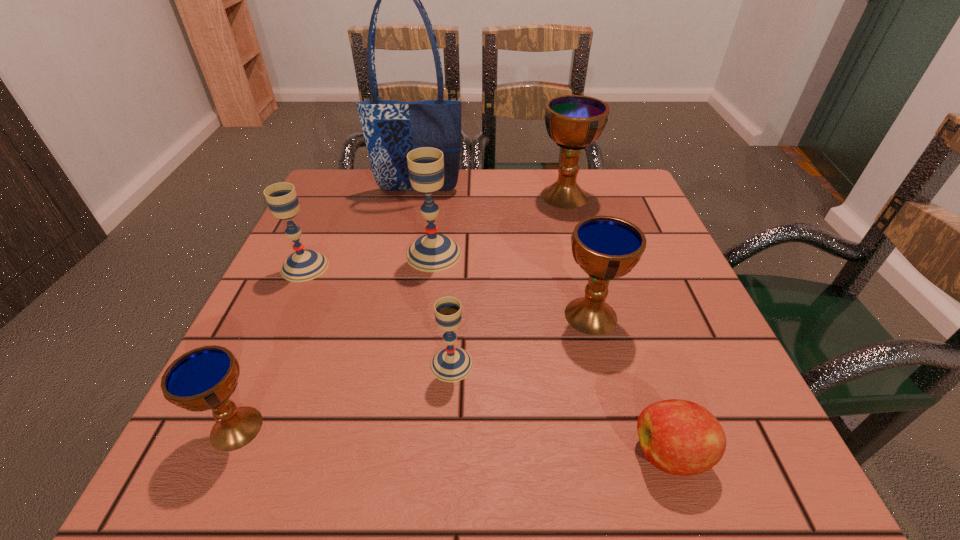
The height and width of the screenshot is (540, 960). Identify the location of object present at the near right corner. (679, 437).

At what (x,y) coordinates should I click in order to perform the action: click on vacant space at the far edge. Please return your answer as a coordinate pair (x, y). The width and height of the screenshot is (960, 540). Looking at the image, I should click on (410, 214).

In order to click on vacant area at the near edge of the desktop in this screenshot , I will do `click(421, 484)`.

Identify the location of free space at the left edge of the desktop. (306, 244).

I want to click on free point at the right edge, so click(x=627, y=340).

Find the location of a particular element. vacant position at the far left corner of the desktop is located at coordinates (312, 212).

The width and height of the screenshot is (960, 540). Identify the location of free space at the far right corner of the desktop. (618, 197).

Where is `free space at the near right corner of the desktop`? free space at the near right corner of the desktop is located at coordinates (701, 487).

I want to click on vacant area between the biggest gray chalice and the red apple, so click(552, 354).

Identify the location of vacant space that is in between the shortest object and the smallest blue chalice. (454, 441).